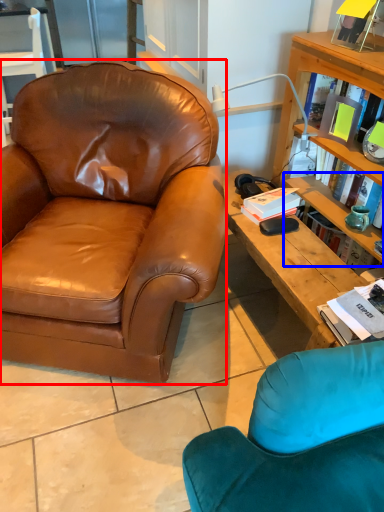
Question: Which object is closer to the camera taking this photo, chair (highlighted by a red box) or shelf (highlighted by a blue box)?

Choices:
 (A) chair
 (B) shelf

Answer: (A)